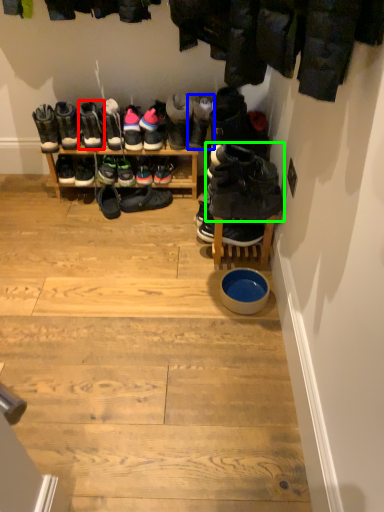
Question: Estimate the real-world distances between objects in this image. Which object is farther from footwear (highlighted by a red box), footwear (highlighted by a blue box) or footwear (highlighted by a green box)?

Choices:
 (A) footwear
 (B) footwear

Answer: (B)